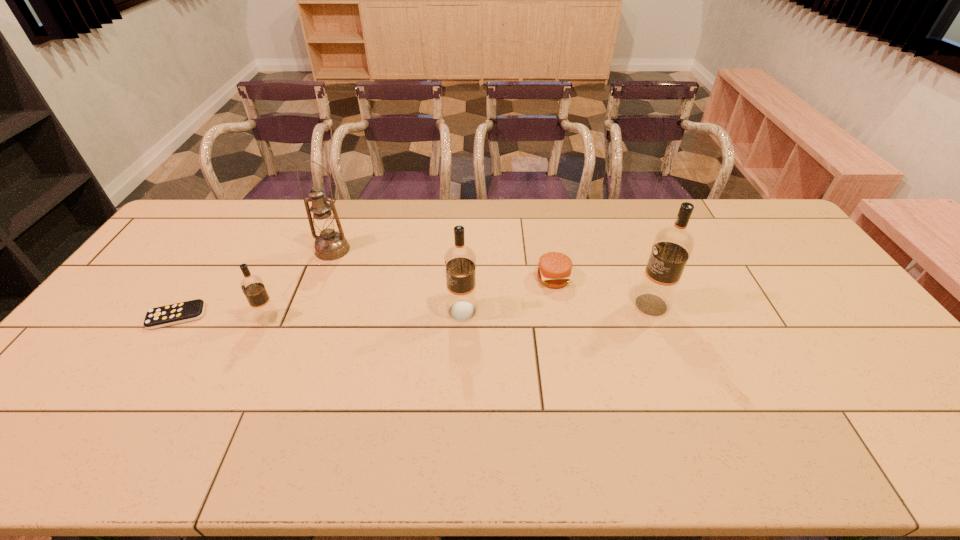
The width and height of the screenshot is (960, 540). Identify the location of unoccupied area between the hamburger and the second shortest vodka. (x=508, y=295).

Locate an element on the screen. empty space between the third object from right to left and the third object from left to right is located at coordinates (397, 280).

I want to click on free spot between the leftmost object and the second vodka from right to left, so click(320, 314).

The height and width of the screenshot is (540, 960). Find the location of `free space between the second vodka from left to right and the rightmost object`. free space between the second vodka from left to right and the rightmost object is located at coordinates (557, 308).

Where is `free spot between the shortest object and the second object from right to left`? free spot between the shortest object and the second object from right to left is located at coordinates (365, 298).

Identify the location of vacant space that's between the fourth object from left to right and the remote control. (320, 314).

I want to click on vacant space that's between the rightmost object and the hamburger, so [x=602, y=292].

The width and height of the screenshot is (960, 540). Find the location of `unoccupied area between the second tallest vodka and the oil lamp`. unoccupied area between the second tallest vodka and the oil lamp is located at coordinates (397, 280).

Locate which object ranks fourth in proximity to the third shortest object. Please provide its 2D coordinates. Your answer should be formatted as a tuple, i.e. [(x, y)], where the tuple contains the x and y coordinates of a point satisfying the conditions above.

[(554, 269)]

The height and width of the screenshot is (540, 960). What are the coordinates of `the second closest object to the second vodka from left to right` in the screenshot? It's located at (330, 245).